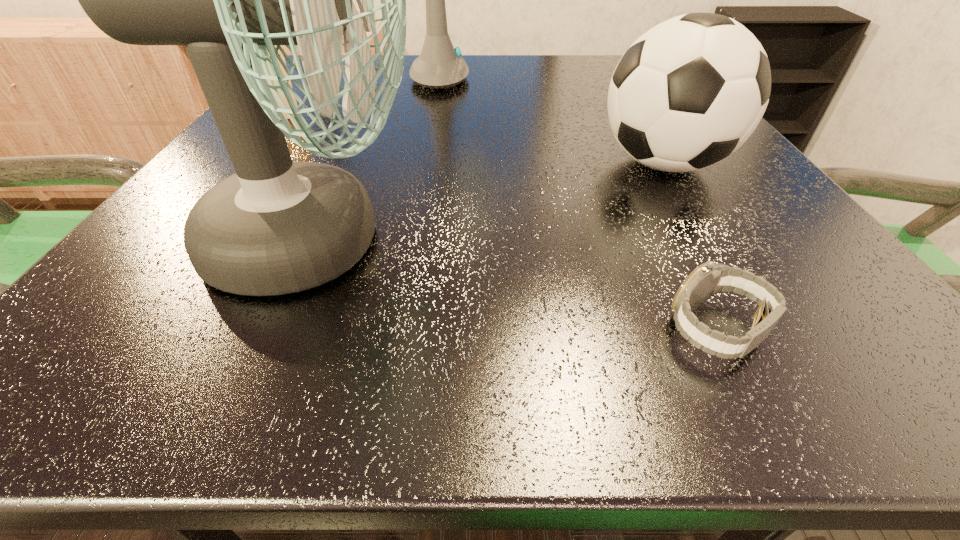
The height and width of the screenshot is (540, 960). In order to click on vacant area between the shortest object and the farther fan in this screenshot , I will do `click(584, 205)`.

Identify the location of blank region between the shortest object and the fourth tallest object. Image resolution: width=960 pixels, height=540 pixels. (501, 222).

Locate an element on the screen. This screenshot has width=960, height=540. vacant space that is in between the third shortest object and the watch is located at coordinates (690, 247).

The width and height of the screenshot is (960, 540). Identify the location of vacant region between the candle and the third shortest object. (474, 139).

At what (x,y) coordinates should I click in order to perform the action: click on free space between the nearer fan and the watch. Please return your answer as a coordinate pair (x, y). The height and width of the screenshot is (540, 960). Looking at the image, I should click on (517, 286).

Find the location of a particular element. free space between the nearer fan and the soccer ball is located at coordinates (491, 202).

You are a GUI agent. You are given a task and a screenshot of the screen. Output one action in this format:
    pyautogui.click(x=<x>, y=<y>)
    Task: Click on the fourth closest object to the soccer ball
    The width and height of the screenshot is (960, 540).
    Given the screenshot: What is the action you would take?
    tap(284, 72)

Find the location of `object that is the fourth closest to the nearer fan`. object that is the fourth closest to the nearer fan is located at coordinates (440, 65).

This screenshot has width=960, height=540. I want to click on vacant space that satisfies the following two spatial constraints: 1. on the front-facing side of the soccer ball; 2. on the right side of the farthest object, so point(438,164).

You are a GUI agent. You are given a task and a screenshot of the screen. Output one action in this format:
    pyautogui.click(x=<x>, y=<y>)
    Task: Click on the blank area in the image that satisfies the following two spatial constraints: 1. on the front side of the third shortest object; 2. in front of the nearer fan where the airflow is directed
    
    Given the screenshot: What is the action you would take?
    coord(711,242)